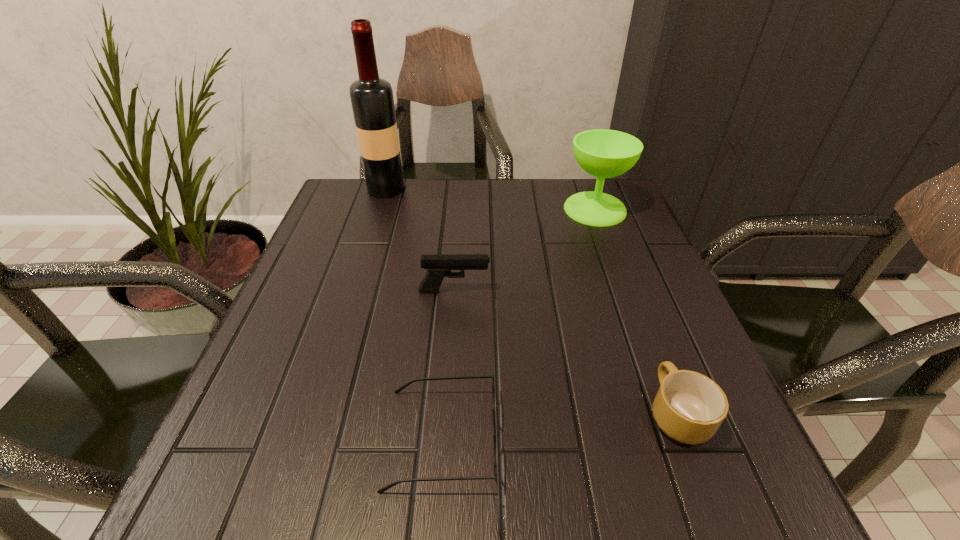
At what (x,y) coordinates should I click in order to perform the action: click on free space that satisfies the following two spatial constraints: 1. on the front-facing side of the third shortest object; 2. on the side with the handle of the mug. Please return your answer as a coordinate pair (x, y). Looking at the image, I should click on [446, 414].

At what (x,y) coordinates should I click in order to perform the action: click on vacant space that satisfies the following two spatial constraints: 1. on the side with the handle of the second shortest object; 2. on the front-facing side of the third nearest object. Please return your answer as a coordinate pair (x, y). The image size is (960, 540). Looking at the image, I should click on (631, 291).

Identify the location of free space that satisfies the following two spatial constraints: 1. on the front side of the tallest object; 2. on the right side of the fourth shortest object. Image resolution: width=960 pixels, height=540 pixels. (379, 209).